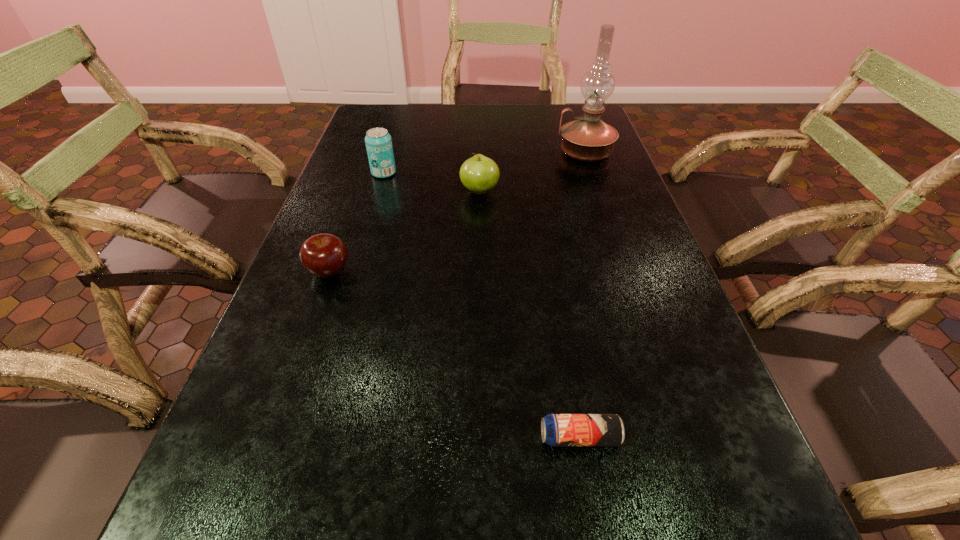
You are a GUI agent. You are given a task and a screenshot of the screen. Output one action in this format:
    pyautogui.click(x=<x>, y=<y>)
    Task: Click on the free space at the far right corner
    The height and width of the screenshot is (540, 960).
    Given the screenshot: What is the action you would take?
    pyautogui.click(x=556, y=107)

I want to click on empty space that is in between the right beer can and the taller apple, so click(x=530, y=314).

The image size is (960, 540). In order to click on free space that is in between the oil lamp and the taller apple in this screenshot , I will do `click(533, 172)`.

Identify the location of blank region between the third object from left to right and the left apple. This screenshot has height=540, width=960. (404, 231).

Find the location of a particular element. This screenshot has width=960, height=540. empty location between the shortest object and the right apple is located at coordinates (530, 314).

Locate an element on the screen. Image resolution: width=960 pixels, height=540 pixels. vacant region between the fourth tallest object and the rightmost object is located at coordinates (457, 212).

At what (x,y) coordinates should I click in order to perform the action: click on vacant point located between the farther apple and the tallest object. Please return your answer as a coordinate pair (x, y). The height and width of the screenshot is (540, 960). Looking at the image, I should click on (533, 172).

Where is `object that is the fourth closest to the tallest object`? The width and height of the screenshot is (960, 540). object that is the fourth closest to the tallest object is located at coordinates (558, 430).

Locate an element on the screen. This screenshot has height=540, width=960. object that ranks as the fourth closest to the oil lamp is located at coordinates (558, 430).

Find the location of a particular element. The height and width of the screenshot is (540, 960). free location that satisfies the following two spatial constraints: 1. on the back side of the oil lamp; 2. on the right side of the nearer apple is located at coordinates (372, 152).